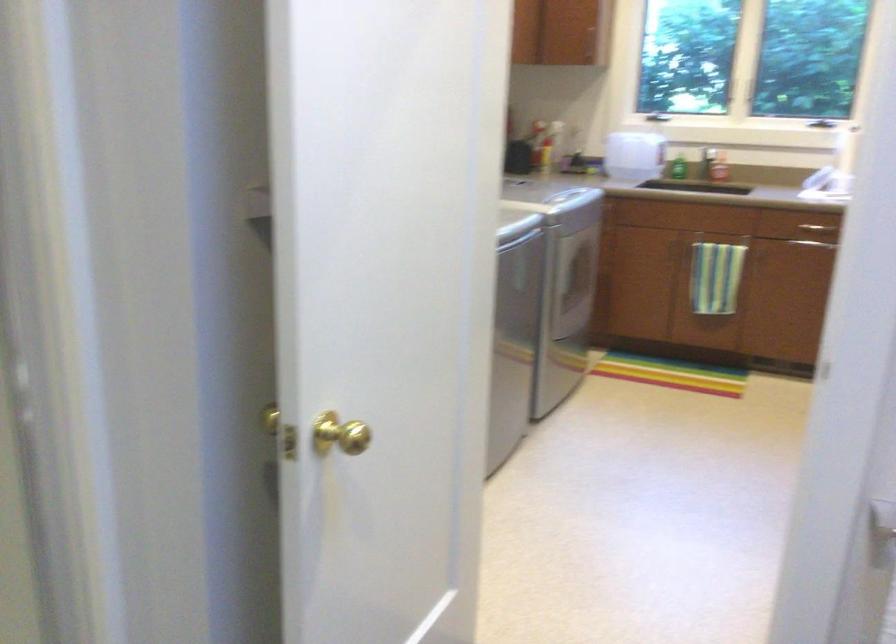
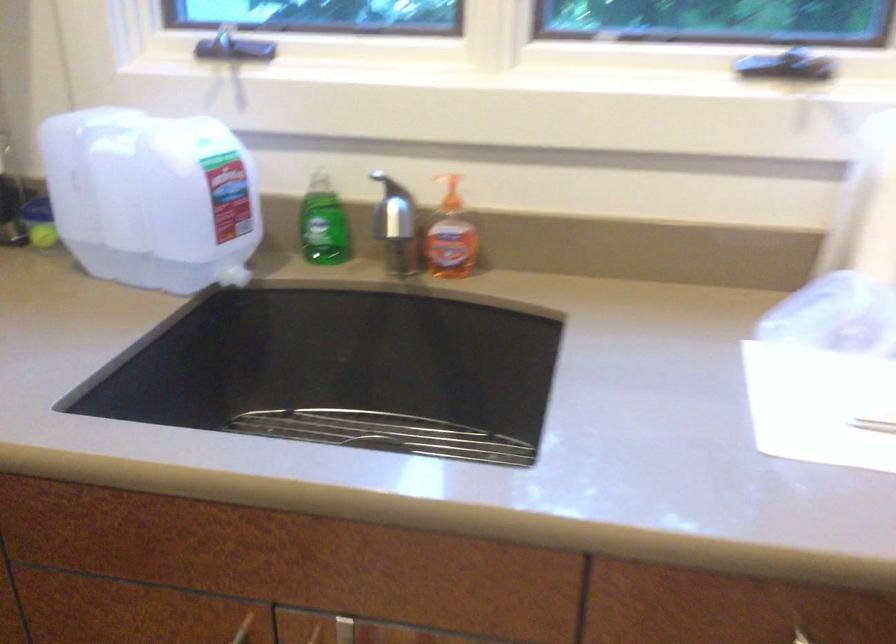
Find the pixel in the second image that matches (670,237) in the first image.

(243, 629)